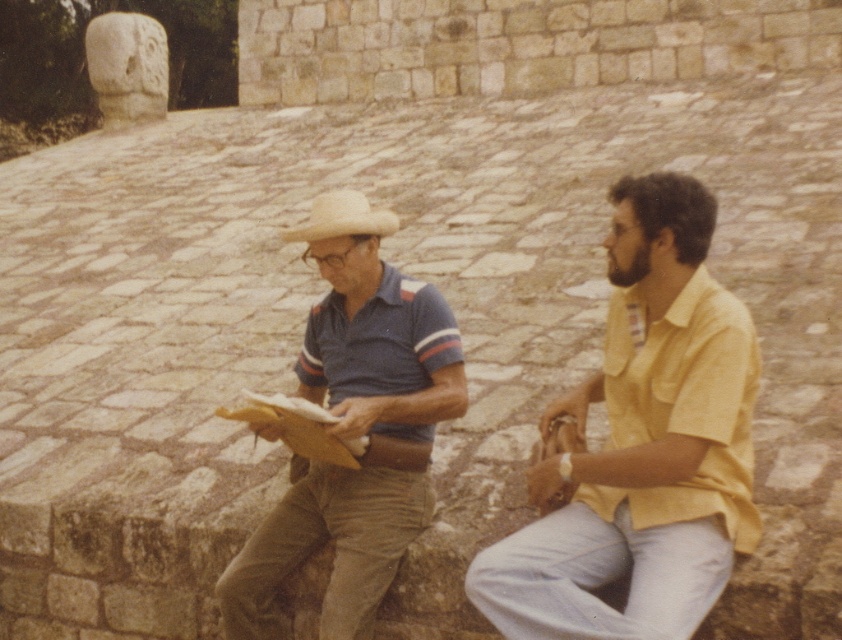
You are a photographer standing at the origin point of the image coordinate system. You want to take a photo of the blue striped polo shirt at center. What are the coordinates where you should aim your camera?

The coordinates to aim the camera are at point (354, 428).